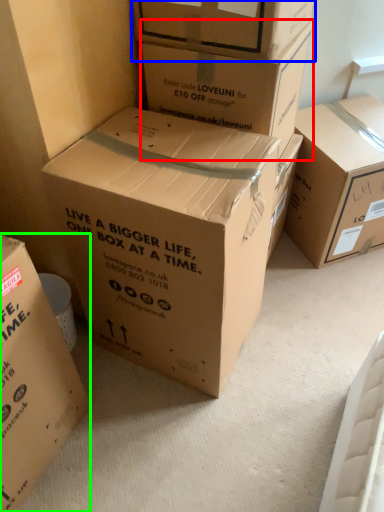
Question: Which object is the farthest from box (highlighted by a red box)? Choose among these: box (highlighted by a blue box) or box (highlighted by a green box).

Choices:
 (A) box
 (B) box

Answer: (B)